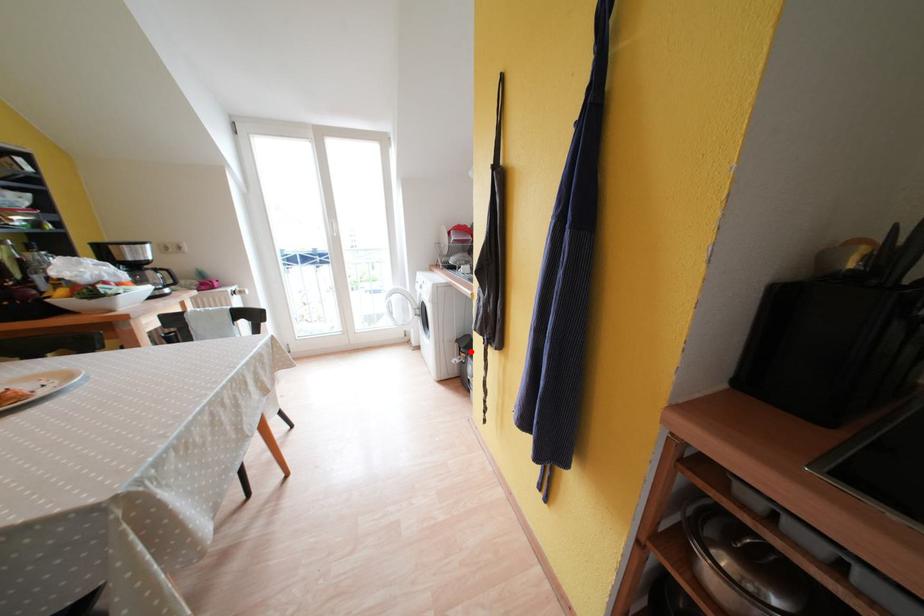
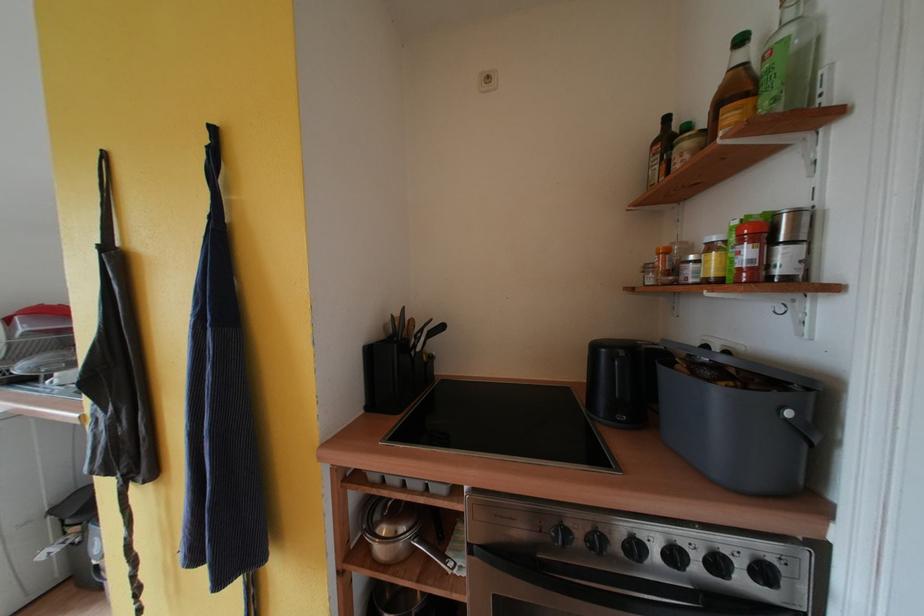
Where in the second image is the point corresponding to the highlighted location from the first image?

(83, 517)